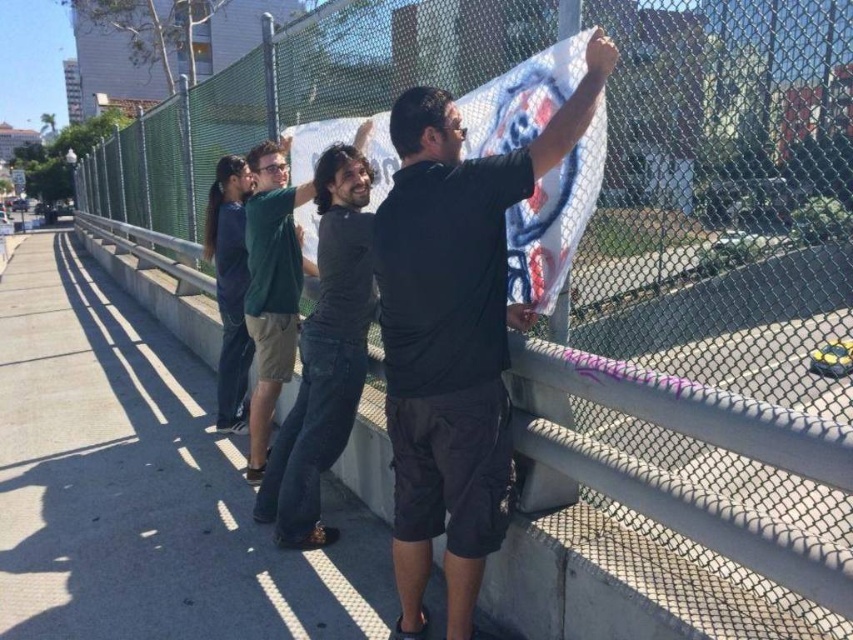
In the scene shown: Between black matte shirt at center and dark gray cotton shirt at center, which one appears on the left side from the viewer's perspective?

Positioned to the left is dark gray cotton shirt at center.

Locate an element on the screen. The height and width of the screenshot is (640, 853). black matte shirt at center is located at coordinates (456, 333).

Looking at this image, who is more distant from viewer, (397,152) or (326,381)?

Positioned behind is point (326,381).

Image resolution: width=853 pixels, height=640 pixels. Find the location of `black matte shirt at center`. black matte shirt at center is located at coordinates (456, 333).